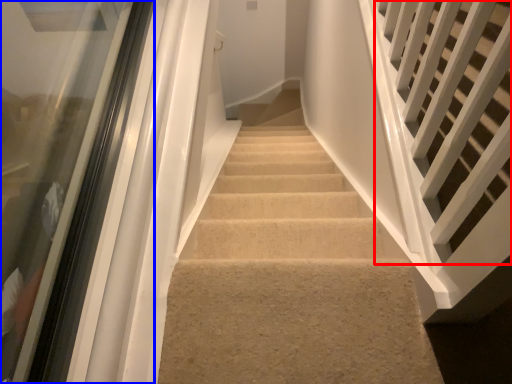
Question: Which of the following is the closest to the observer, stairs (highlighted by a red box) or glass door (highlighted by a blue box)?

Choices:
 (A) stairs
 (B) glass door

Answer: (A)